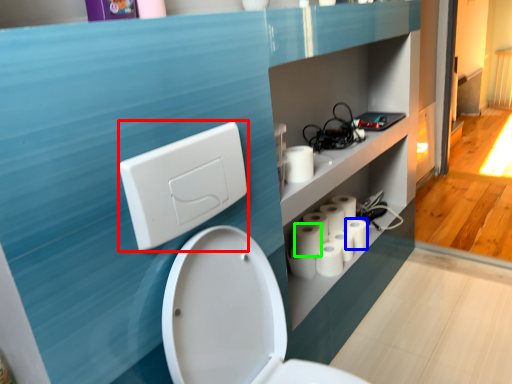
Question: Estimate the real-world distances between objects in this image. Which object is farther from light switch (highlighted by a red box), toilet paper (highlighted by a blue box) or toilet paper (highlighted by a green box)?

Choices:
 (A) toilet paper
 (B) toilet paper

Answer: (A)